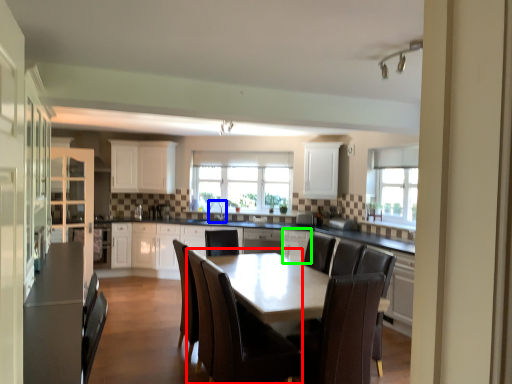
Question: Which is farther away from chair (highlighted by a red box)? sink (highlighted by a blue box) or cabinetry (highlighted by a green box)?

Choices:
 (A) sink
 (B) cabinetry

Answer: (A)